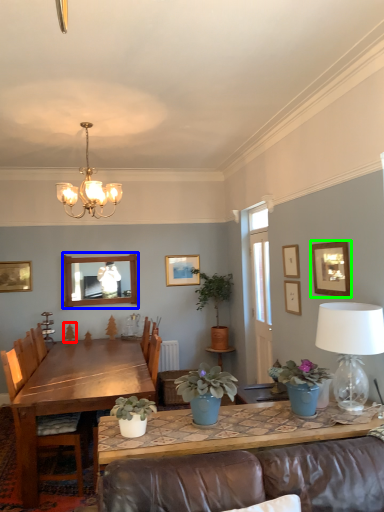
Question: Considering the real-world distances, which object is farthest from plant (highlighted by a red box)? mirror (highlighted by a blue box) or picture frame (highlighted by a green box)?

Choices:
 (A) mirror
 (B) picture frame

Answer: (B)